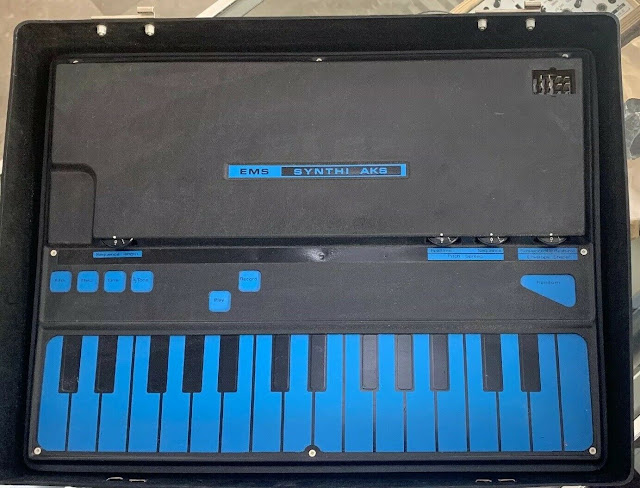
Where is `knobs`? This screenshot has height=488, width=640. knobs is located at coordinates (448, 239), (495, 239), (552, 236), (116, 234).